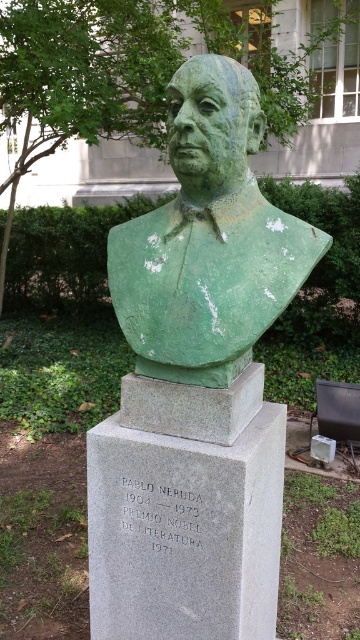
Who is more distant from viewer, (142,248) or (232,173)?

Positioned behind is point (142,248).

Between green matte bust at center and green patina bust at center, which one is positioned higher?

Positioned higher is green patina bust at center.

You are a GUI agent. You are given a task and a screenshot of the screen. Output one action in this format:
    pyautogui.click(x=<x>, y=<y>)
    Task: Click on the green matte bust at center
    The width and height of the screenshot is (360, 640).
    Given the screenshot: What is the action you would take?
    pyautogui.click(x=208, y=237)